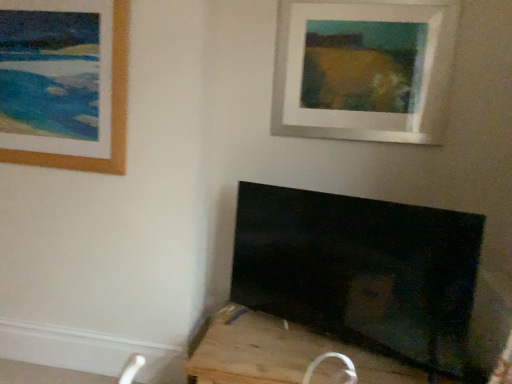
Question: Is black matte tv at lower right far away from wooden frame at upper left, the first picture frame viewed from the left?

Choices:
 (A) yes
 (B) no

Answer: (A)

Question: Is black matte tv at lower right turned away from wooden frame at upper left, the 2th picture frame in the right-to-left sequence?

Choices:
 (A) no
 (B) yes

Answer: (A)

Question: From the image's perspective, does black matte tv at lower right appear lower than wooden frame at upper left, the first picture frame viewed from the left?

Choices:
 (A) yes
 (B) no

Answer: (A)

Question: From a real-world perspective, is black matte tv at lower right positioned over wooden frame at upper left, the first picture frame viewed from the left, based on gravity?

Choices:
 (A) no
 (B) yes

Answer: (A)

Question: Is black matte tv at lower right smaller than wooden frame at upper left, the 2th picture frame in the right-to-left sequence?

Choices:
 (A) yes
 (B) no

Answer: (B)

Question: From a real-world perspective, relative to white matte picture frame at upper center, the first picture frame when ordered from right to left, is black matte tv at lower right vertically above or below?

Choices:
 (A) below
 (B) above

Answer: (A)

Question: From the image's perspective, relative to white matte picture frame at upper center, the first picture frame when ordered from right to left, is black matte tv at lower right above or below?

Choices:
 (A) above
 (B) below

Answer: (B)

Question: In terms of size, does black matte tv at lower right appear bigger or smaller than white matte picture frame at upper center, the second picture frame when ordered from left to right?

Choices:
 (A) big
 (B) small

Answer: (A)

Question: Considering the positions of black matte tv at lower right and white matte picture frame at upper center, the second picture frame when ordered from left to right, in the image, is black matte tv at lower right wider or thinner than white matte picture frame at upper center, the second picture frame when ordered from left to right,?

Choices:
 (A) thin
 (B) wide

Answer: (B)

Question: In the image, is wooden frame at upper left, the first picture frame viewed from the left, on the left side or the right side of white matte picture frame at upper center, the second picture frame when ordered from left to right?

Choices:
 (A) right
 (B) left

Answer: (B)

Question: Relative to white matte picture frame at upper center, the first picture frame when ordered from right to left, is wooden frame at upper left, the 2th picture frame in the right-to-left sequence, in front or behind?

Choices:
 (A) front
 (B) behind

Answer: (A)

Question: From the image's perspective, is wooden frame at upper left, the 2th picture frame in the right-to-left sequence, located above or below white matte picture frame at upper center, the first picture frame when ordered from right to left?

Choices:
 (A) below
 (B) above

Answer: (A)

Question: Considering the positions of wooden frame at upper left, the first picture frame viewed from the left, and white matte picture frame at upper center, the first picture frame when ordered from right to left, in the image, is wooden frame at upper left, the first picture frame viewed from the left, bigger or smaller than white matte picture frame at upper center, the first picture frame when ordered from right to left,?

Choices:
 (A) big
 (B) small

Answer: (B)

Question: Considering the positions of white matte picture frame at upper center, the first picture frame when ordered from right to left, and wooden frame at upper left, the first picture frame viewed from the left, in the image, is white matte picture frame at upper center, the first picture frame when ordered from right to left, wider or thinner than wooden frame at upper left, the first picture frame viewed from the left,?

Choices:
 (A) thin
 (B) wide

Answer: (B)

Question: From a real-world perspective, is white matte picture frame at upper center, the second picture frame when ordered from left to right, positioned above or below wooden frame at upper left, the 2th picture frame in the right-to-left sequence?

Choices:
 (A) above
 (B) below

Answer: (A)